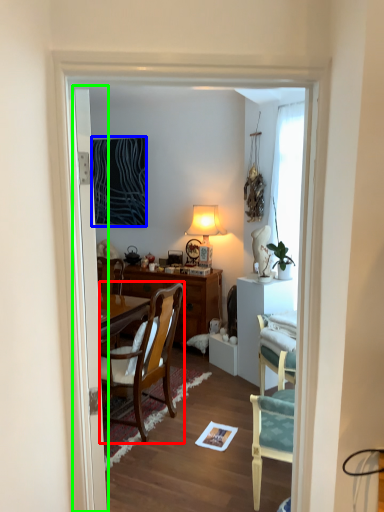
Question: Which object is the closest to the chair (highlighted by a red box)? Choose among these: picture frame (highlighted by a blue box) or door (highlighted by a green box).

Choices:
 (A) picture frame
 (B) door

Answer: (B)